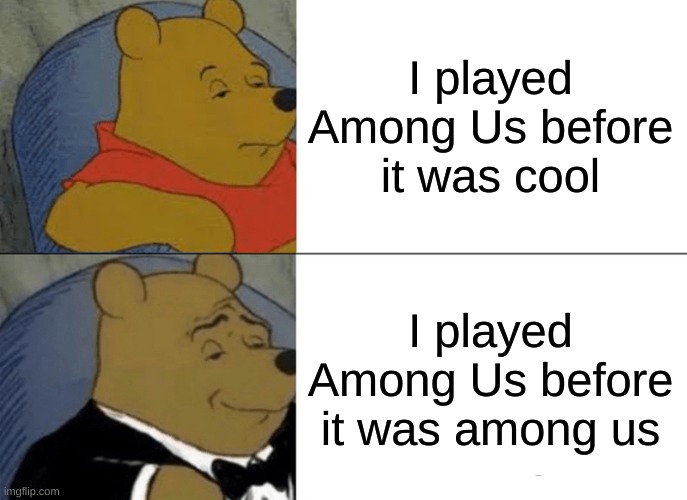
Image resolution: width=687 pixels, height=500 pixels. In order to click on blue chairs in this screenshot , I will do `click(80, 340)`, `click(82, 77)`.